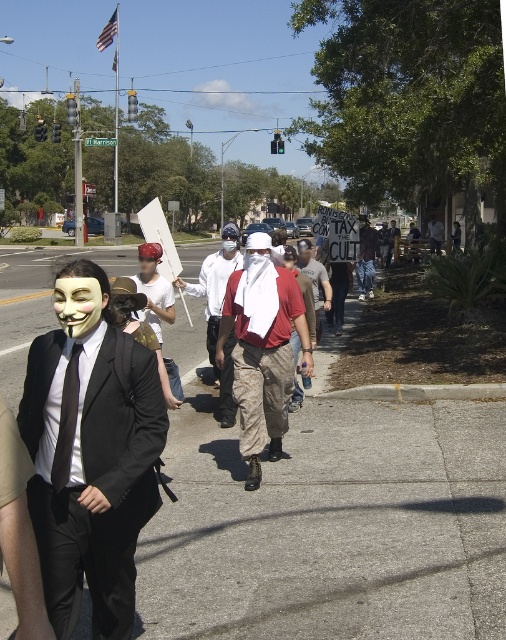
You are a photographer at the protest scene. You need to capture a photo where both the white matte mask at center and the white cotton shirt at center are visible. Based on their positions, which object should be placed on the left side of the photo frame?

The white matte mask at center should be placed on the left side of the photo frame since it is to the left of the white cotton shirt at center according to the description.

You are a photographer trying to capture a clear shot of both the matte black suit at left and the white cotton shirt at center. Since you want both subjects to appear equally sized in your photo, which adjustment should you make based on their actual sizes?

The matte black suit at left is much taller than the white cotton shirt at center. To make them appear equal in size, you should move closer to the shorter white cotton shirt at center while moving farther away from the taller matte black suit at left.

You are a photographer standing in front of the protest scene. You want to take a photo that includes both the formally dressed person with the Guy Fawkes mask and another protester. The formally dressed person is at point (x=67, y=324), and the other protester is at point (x=434, y=230). Which protester should you focus on first to ensure they are in sharp focus?

You should focus on the formally dressed person at point (x=67, y=324) first because they are closer to the viewer than the other protester at point (x=434, y=230), ensuring they will be in sharp focus.